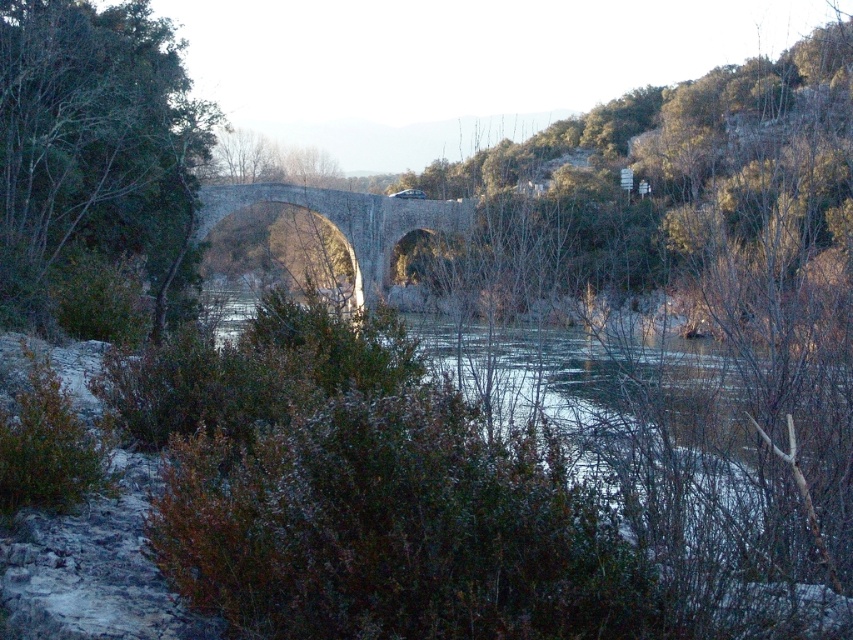
Question: Is green leafy tree at center to the left of stone bridge at center from the viewer's perspective?

Choices:
 (A) yes
 (B) no

Answer: (A)

Question: Does green leafy tree at center have a larger size compared to stone bridge at center?

Choices:
 (A) yes
 (B) no

Answer: (B)

Question: Can you confirm if green leafy tree at center is bigger than stone bridge at center?

Choices:
 (A) no
 (B) yes

Answer: (A)

Question: Which point is farther from the camera taking this photo?

Choices:
 (A) (447, 228)
 (B) (112, 10)

Answer: (A)